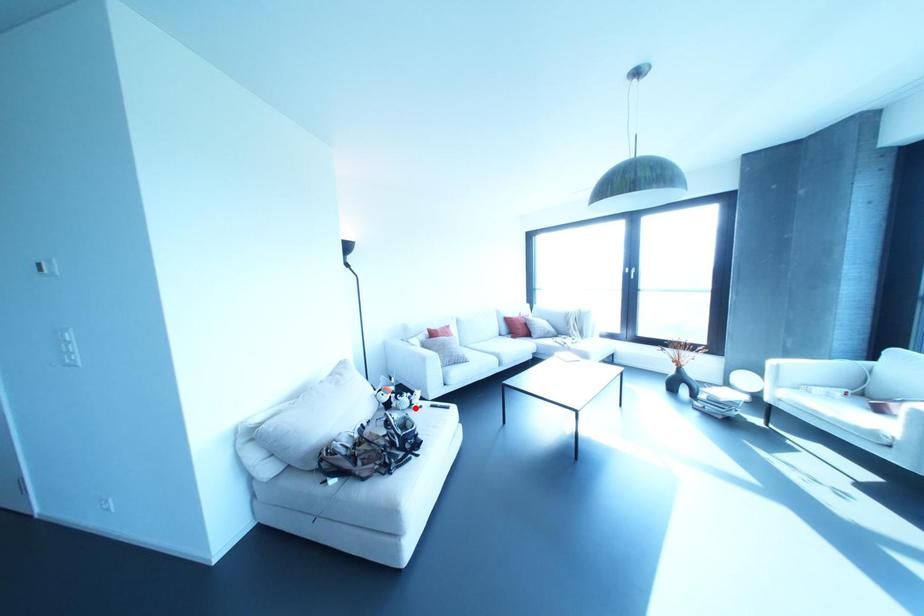
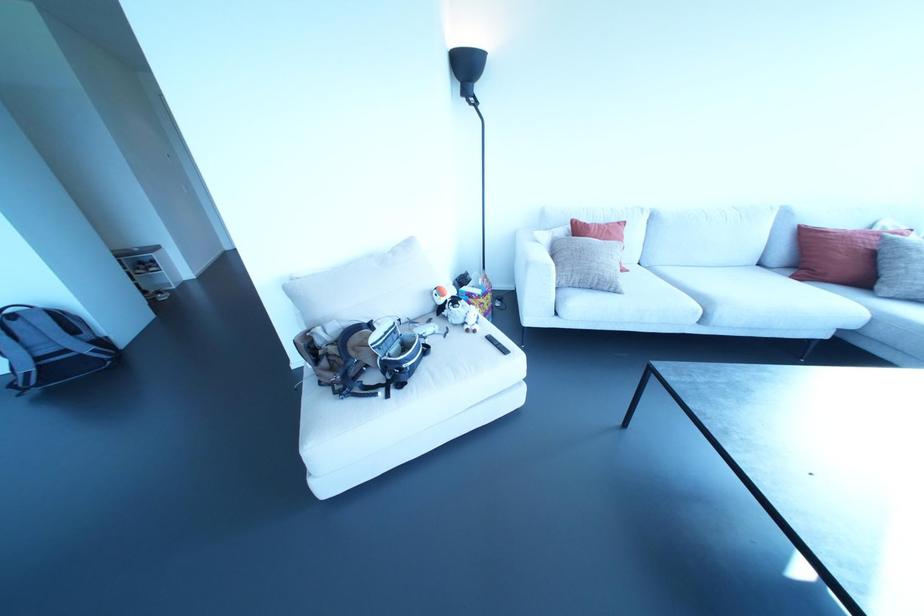
Question: I am providing you with two images of the same scene from different viewpoints. A red point is marked on the first image. Can you still see the location of the red point in image 2?

Choices:
 (A) Yes
 (B) No

Answer: (A)